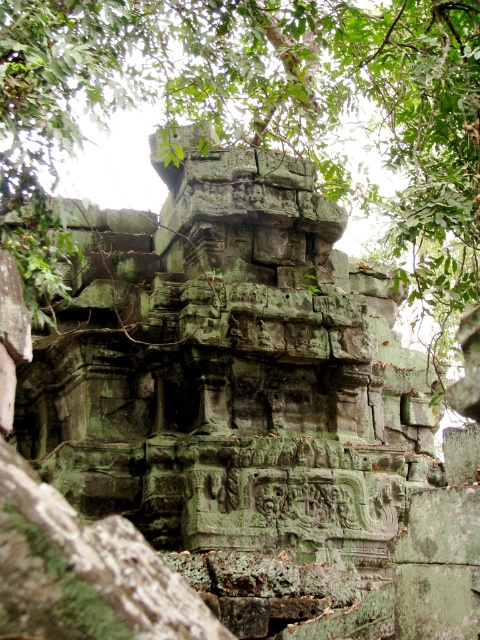
Question: Which point is farther from the camera taking this photo?

Choices:
 (A) (156, 563)
 (B) (286, 4)

Answer: (B)

Question: Which point is closer to the camera taking this photo?

Choices:
 (A) (7, 467)
 (B) (453, 106)

Answer: (A)

Question: Can you confirm if green mossy stone at upper center is bigger than green mossy bark at center?

Choices:
 (A) no
 (B) yes

Answer: (B)

Question: Which of the following is the farthest from the observer?

Choices:
 (A) green mossy bark at center
 (B) green mossy stone at upper center

Answer: (B)

Question: Is green mossy stone at upper center to the right of green mossy bark at center from the viewer's perspective?

Choices:
 (A) no
 (B) yes

Answer: (B)

Question: Can you confirm if green mossy stone at upper center is smaller than green mossy bark at center?

Choices:
 (A) no
 (B) yes

Answer: (A)